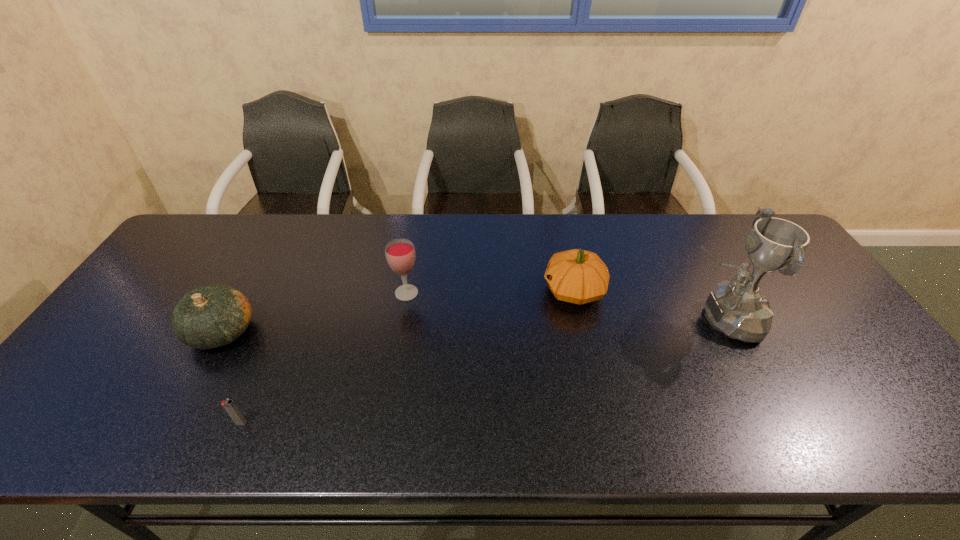
In the image, there is a desktop. Identify the location of vacant region at the right edge. (845, 333).

In the image, there is a desktop. Identify the location of vacant space at the far right corner. This screenshot has height=540, width=960. (744, 246).

This screenshot has height=540, width=960. Find the location of `vacant space at the near right corner of the desktop`. vacant space at the near right corner of the desktop is located at coordinates (907, 429).

Where is `free area in between the wineglass and the nearest object`? Image resolution: width=960 pixels, height=540 pixels. free area in between the wineglass and the nearest object is located at coordinates (324, 358).

Find the location of a particular element. This screenshot has width=960, height=540. empty space that is in between the second object from right to left and the award is located at coordinates (648, 305).

Find the location of a particular element. free space between the wineglass and the second object from right to left is located at coordinates (491, 292).

Locate an element on the screen. The height and width of the screenshot is (540, 960). vacant point located between the rightmost object and the third object from right to left is located at coordinates (564, 306).

What are the coordinates of `vacant space in between the leftmost object and the rightmost object` in the screenshot? It's located at (472, 325).

Locate an element on the screen. The width and height of the screenshot is (960, 540). free space between the shortest object and the wineglass is located at coordinates (324, 358).

This screenshot has height=540, width=960. In order to click on vacant space in between the tallest object and the second object from right to left in this screenshot , I will do (648, 305).